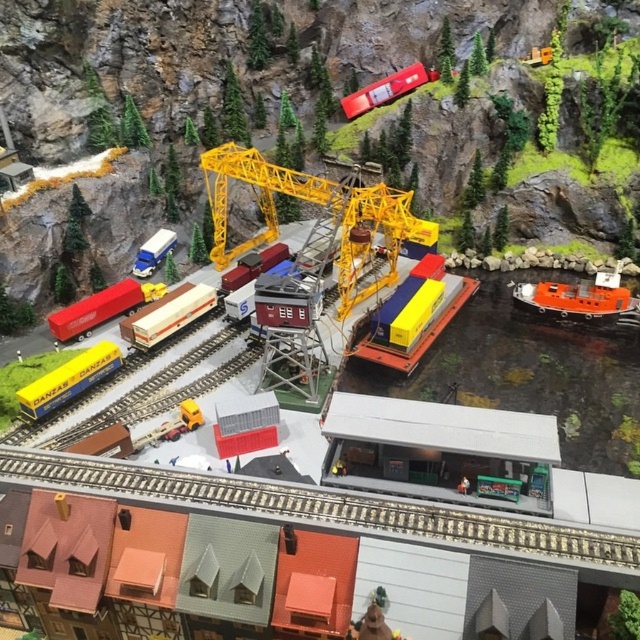
You are an observer looking at the miniature diorama. You see an orange matte boat at right and a wooden grain train car at center. Which object is located to the right of the other?

The orange matte boat at right is positioned on the right side of wooden grain train car at center, so the orange matte boat at right is to the right of the wooden grain train car at center.

You are an engineer inspecting the miniature diorama. You need to place a new object between the yellow metallic crane at center and the metallic red train at upper center. Given their widths, which object should you place closer to the narrower one to ensure stability?

The yellow metallic crane at center has a lesser width compared to the metallic red train at upper center. Therefore, to ensure stability, the new object should be placed closer to the yellow metallic crane at center since it has a smaller base area and might require more support.

In the miniature diorama, there are a wooden grain train car at center and a yellow matte container at center. Based on their positions, which one is located to the left?

The wooden grain train car at center is to the left of the yellow matte container at center.